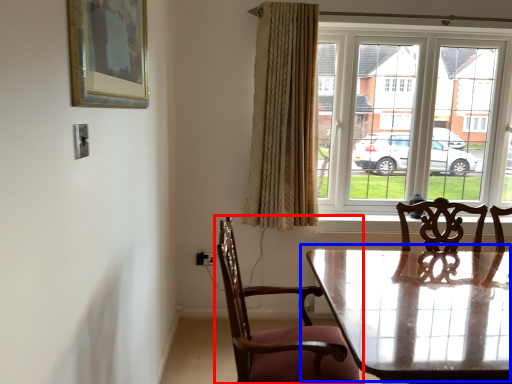
Question: Which object is closer to the camera taking this photo, chair (highlighted by a red box) or table (highlighted by a blue box)?

Choices:
 (A) chair
 (B) table

Answer: (A)